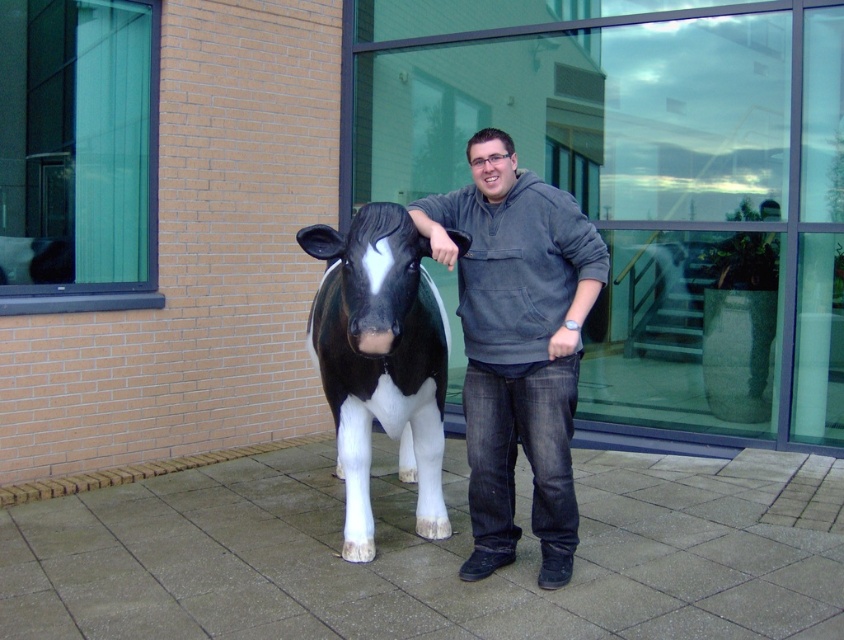
Question: Does gray hoodie at center appear on the right side of black glossy plastic bull at center?

Choices:
 (A) no
 (B) yes

Answer: (B)

Question: Which object appears closest to the camera in this image?

Choices:
 (A) black glossy plastic bull at center
 (B) gray hoodie at center

Answer: (A)

Question: Among these points, which one is farthest from the camera?

Choices:
 (A) (528, 296)
 (B) (329, 380)

Answer: (B)

Question: Which point is closer to the camera?

Choices:
 (A) gray hoodie at center
 (B) black glossy plastic bull at center

Answer: (B)

Question: Does gray hoodie at center appear over black glossy plastic bull at center?

Choices:
 (A) yes
 (B) no

Answer: (B)

Question: In this image, where is gray hoodie at center located relative to black glossy plastic bull at center?

Choices:
 (A) above
 (B) below

Answer: (B)